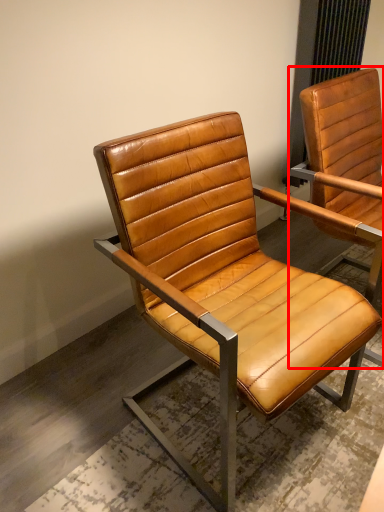
Question: From the image's perspective, considering the relative positions of chair (annotated by the red box) and chair in the image provided, where is chair (annotated by the red box) located with respect to the staircase?

Choices:
 (A) above
 (B) below

Answer: (A)